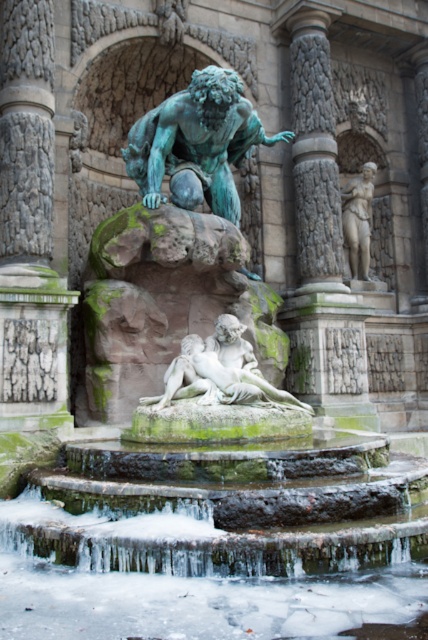
Question: Based on their relative distances, which object is nearer to the icy stone water at center?

Choices:
 (A) green patina bronze statue at center
 (B) white marble statue at center-right
 (C) white marble statue at center

Answer: (C)

Question: Which point appears farthest from the camera in this image?

Choices:
 (A) (225, 216)
 (B) (269, 624)
 (C) (365, 246)
 (D) (174, 358)

Answer: (C)

Question: Does white marble statue at center have a smaller size compared to white marble statue at center-right?

Choices:
 (A) no
 (B) yes

Answer: (A)

Question: Does white marble statue at center appear on the right side of white marble statue at center-right?

Choices:
 (A) no
 (B) yes

Answer: (A)

Question: Is green patina bronze statue at center positioned at the back of white marble statue at center-right?

Choices:
 (A) no
 (B) yes

Answer: (A)

Question: Which object is the farthest from the white marble statue at center-right?

Choices:
 (A) white marble statue at center
 (B) green patina bronze statue at center

Answer: (A)